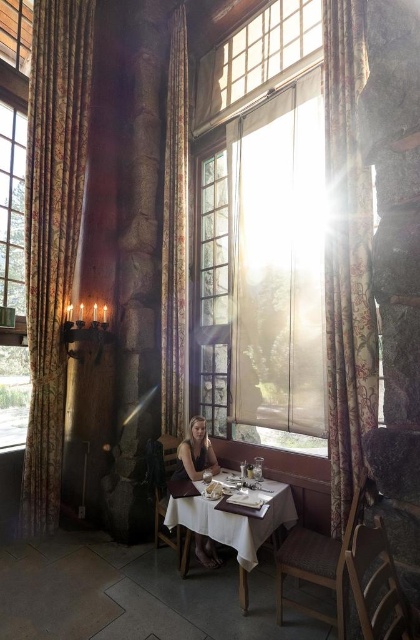
Does gold floral fabric curtain at left have a lesser width compared to white cloth table at center?

Yes.

Measure the distance between point (57, 464) and camera.

Point (57, 464) and camera are 4.77 meters apart.

Identify the location of gold floral fabric curtain at left. (52, 236).

The height and width of the screenshot is (640, 420). What are the coordinates of `gold floral fabric curtain at left` in the screenshot? It's located at (52, 236).

Does point (354, 449) come closer to viewer compared to point (217, 493)?

Yes, point (354, 449) is closer to viewer.

What do you see at coordinates (346, 257) in the screenshot? I see `floral fabric curtain at right` at bounding box center [346, 257].

Describe the element at coordinates (346, 257) in the screenshot. I see `floral fabric curtain at right` at that location.

This screenshot has width=420, height=640. I want to click on floral fabric curtain at right, so click(346, 257).

Does gold floral fabric curtain at left lie in front of white paper napkin at center?

→ That is False.

In the scene shown: Who is more forward, (44,40) or (207,488)?

Positioned in front is point (207,488).

What do you see at coordinates (52, 236) in the screenshot? I see `gold floral fabric curtain at left` at bounding box center [52, 236].

The height and width of the screenshot is (640, 420). Find the location of `gold floral fabric curtain at left`. gold floral fabric curtain at left is located at coordinates (52, 236).